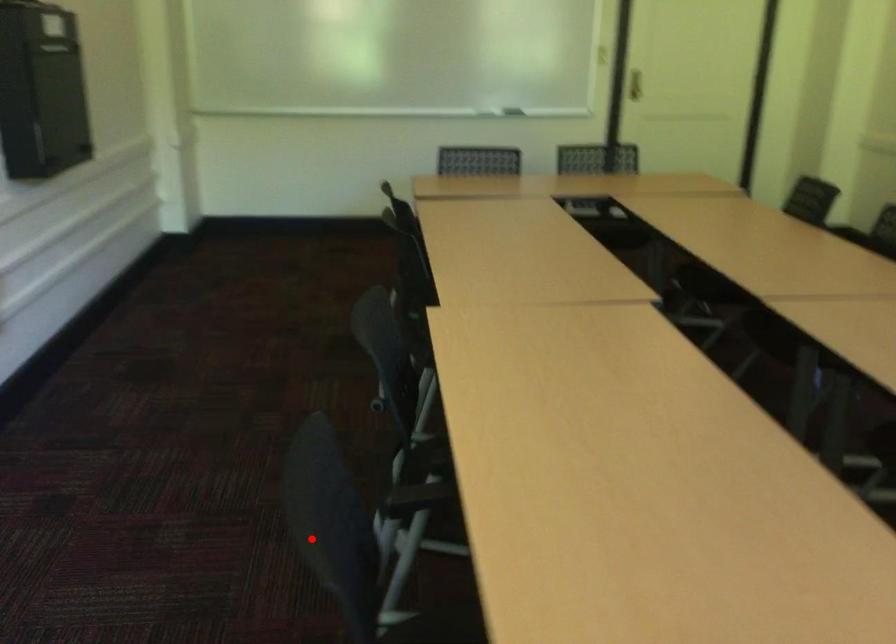
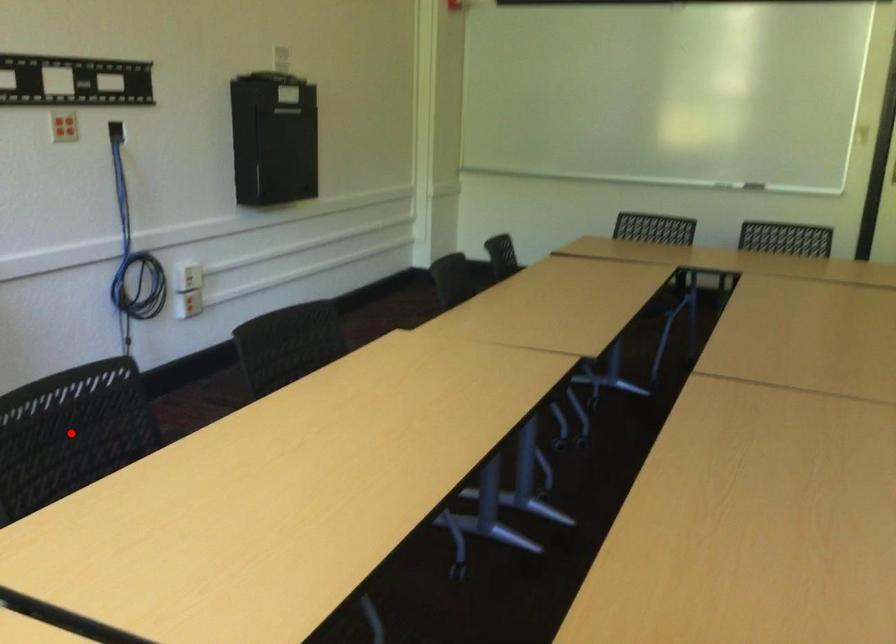
I am providing you with two images of the same scene from different viewpoints. A red point is marked on the first image and another point is marked on the second image. Is the marked point in image1 the same physical position as the marked point in image2?

Yes